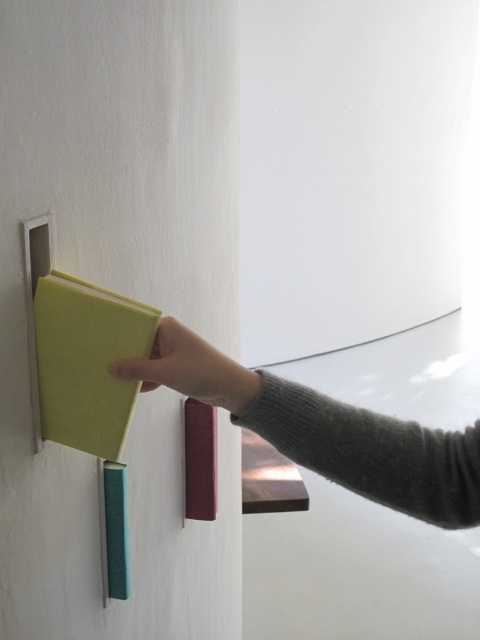
Between gray wool sweater at upper center and matte green book at center, which one is positioned higher?

Positioned higher is matte green book at center.

Can you confirm if gray wool sweater at upper center is shorter than matte green book at center?

No.

Which is behind, point (324, 458) or point (226, 385)?

Positioned behind is point (324, 458).

This screenshot has width=480, height=640. I want to click on gray wool sweater at upper center, so click(x=324, y=429).

Can you confirm if green felt folder at upper left is taller than matte green book at center?

Yes.

The height and width of the screenshot is (640, 480). Identify the location of green felt folder at upper left. [x=86, y=362].

Does gray wool sweater at upper center appear over green felt folder at upper left?

No, gray wool sweater at upper center is not above green felt folder at upper left.

Does gray wool sweater at upper center appear on the right side of green felt folder at upper left?

Correct, you'll find gray wool sweater at upper center to the right of green felt folder at upper left.

Is point (193, 342) more distant than point (70, 412)?

No.

Where is `gray wool sweater at upper center`? The image size is (480, 640). gray wool sweater at upper center is located at coordinates coord(324,429).